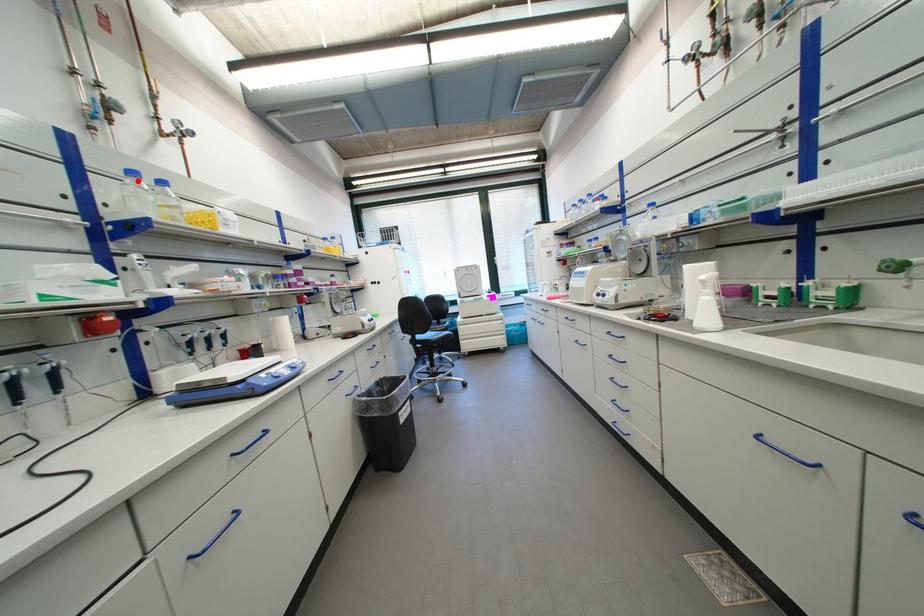
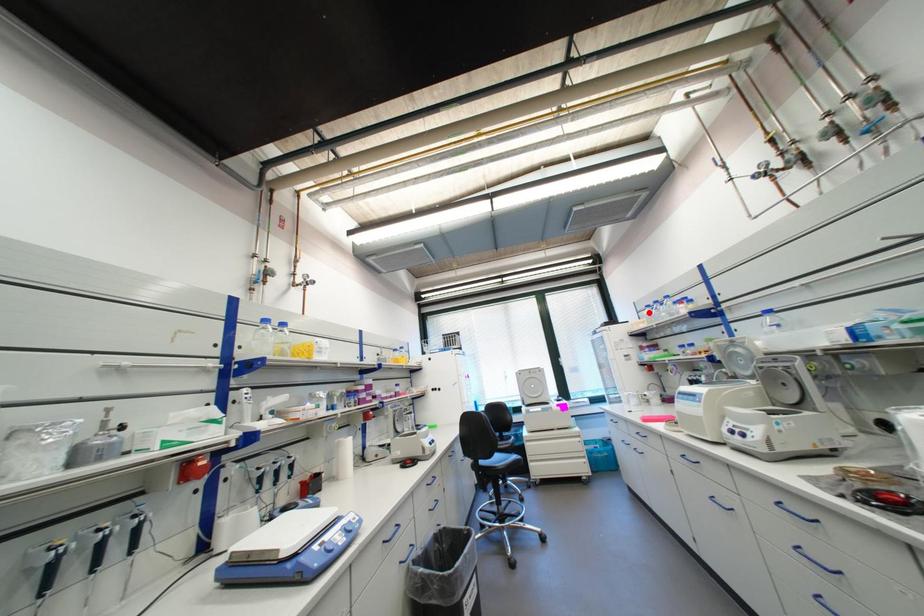
I am providing you with two images of the same scene from different viewpoints. A red point is marked on the first image and another point is marked on the second image. Are the points marked in image1 and image2 representing the same 3D position?

→ No